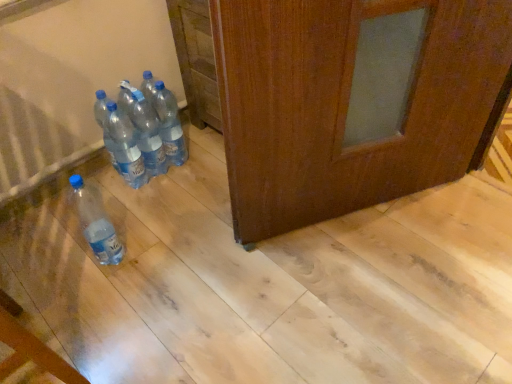
Locate an element on the screen. vacant area that is situated to the right of matte plastic bottle at lower left, marked as the 1th bottle in a left-to-right arrangement is located at coordinates (160, 255).